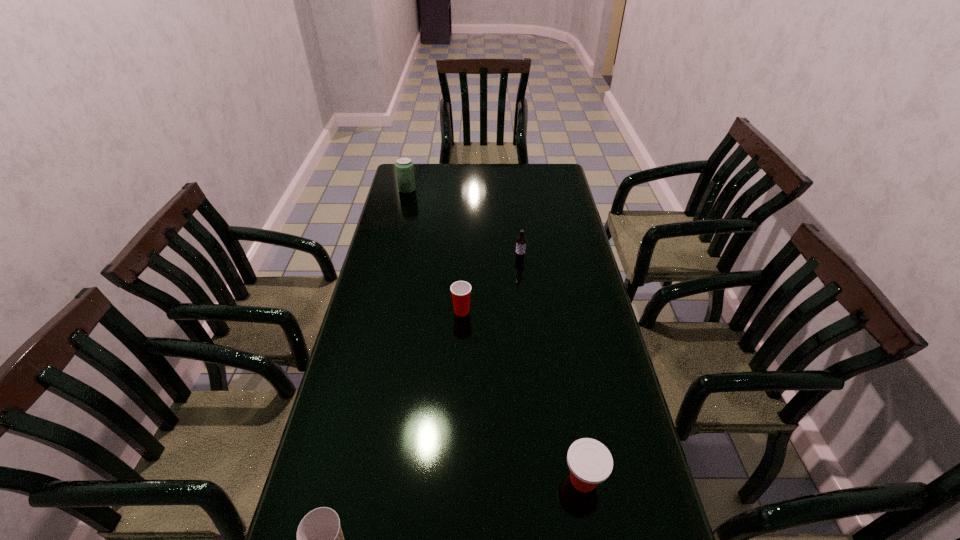
Where is `soda`? This screenshot has width=960, height=540. soda is located at coordinates (404, 166).

In order to click on root beer in this screenshot , I will do `click(521, 241)`.

Locate an element on the screen. the fourth nearest object is located at coordinates (521, 241).

The height and width of the screenshot is (540, 960). In order to click on the third object from right to left in this screenshot , I will do `click(461, 290)`.

Where is `the farthest Dixie cup`? Image resolution: width=960 pixels, height=540 pixels. the farthest Dixie cup is located at coordinates (461, 290).

Where is `the second farthest Dixie cup`? the second farthest Dixie cup is located at coordinates (590, 462).

The height and width of the screenshot is (540, 960). In order to click on the rightmost object in this screenshot , I will do `click(590, 462)`.

This screenshot has width=960, height=540. I want to click on free space located 0.050m on the back of the soda, so click(x=410, y=180).

The height and width of the screenshot is (540, 960). What are the coordinates of `free space located on the back of the second object from right to left` in the screenshot? It's located at (517, 237).

Identify the location of vacant space located 0.280m on the front of the third farthest object. The height and width of the screenshot is (540, 960). (458, 395).